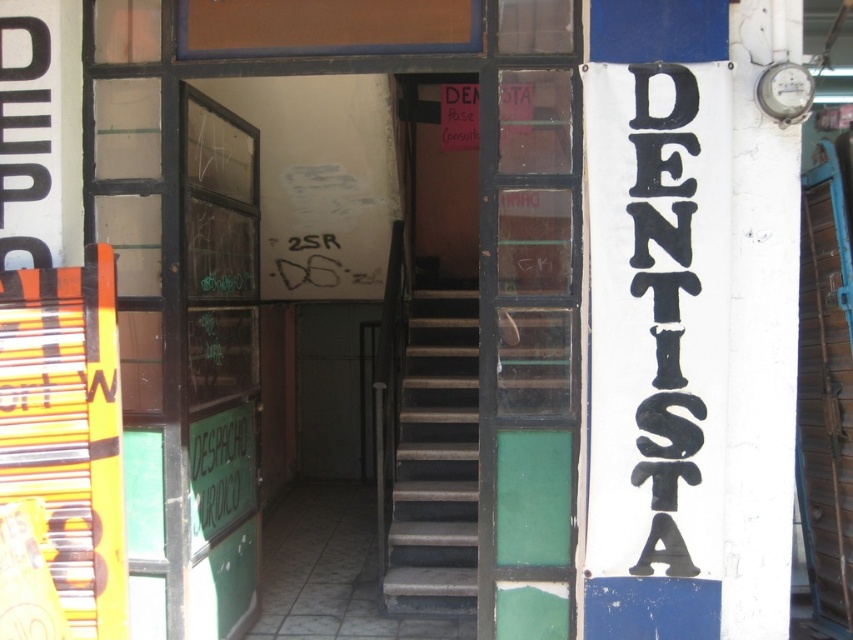
Question: Among these points, which one is farthest from the camera?

Choices:
 (A) (480, 513)
 (B) (184, 140)
 (C) (438, 512)

Answer: (C)

Question: Based on their relative distances, which object is nearer to the green glass door at left?

Choices:
 (A) dark gray concrete stairs at center
 (B) green glass door at center

Answer: (A)

Question: Can you confirm if green glass door at center is thinner than green glass door at left?

Choices:
 (A) yes
 (B) no

Answer: (B)

Question: Which of the following is the closest to the observer?

Choices:
 (A) (527, 189)
 (B) (221, 333)

Answer: (A)

Question: Can you confirm if green glass door at left is positioned above dark gray concrete stairs at center?

Choices:
 (A) yes
 (B) no

Answer: (A)

Question: Where is green glass door at left located in relation to dark gray concrete stairs at center in the image?

Choices:
 (A) left
 (B) right

Answer: (A)